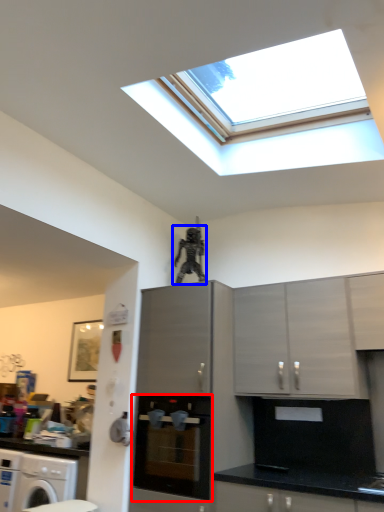
Question: Which of the following is the closest to the observer, home appliance (highlighted by a red box) or person (highlighted by a blue box)?

Choices:
 (A) home appliance
 (B) person

Answer: (A)